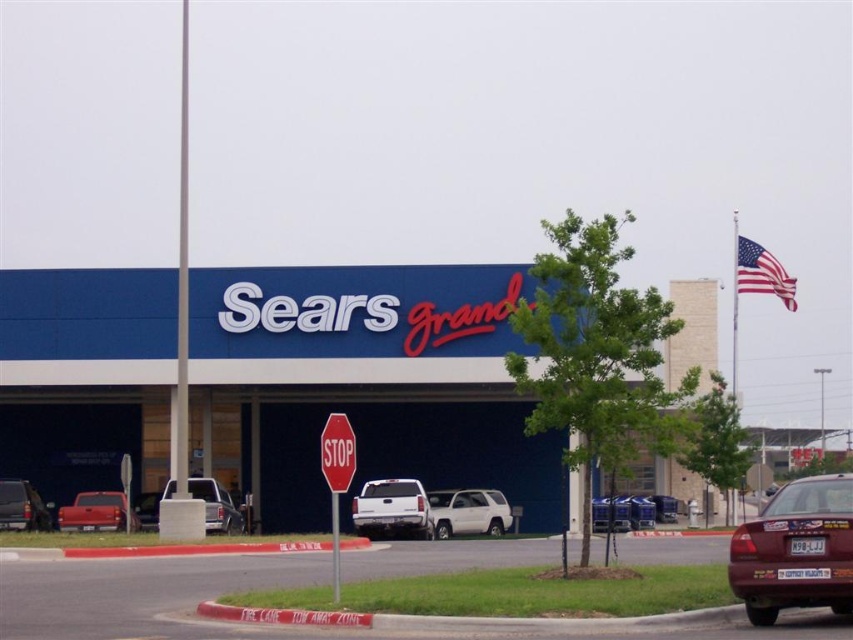
You are a delivery driver who needs to park your truck next to the maroon matte car at lower right. However, there is a height restriction of 6 feet in the parking spot. Given that the white matte suv at center is already parked there, can you safely park your truck without exceeding the height limit?

The maroon matte car at lower right has a lesser height compared to the white matte suv at center. Since the SUV is taller than the car and the height restriction is 6 feet, if the SUV is within the limit, then the maroon car is also under 6 feet. However, if the SUV exceeds the limit, the truck might also be too tall. Without knowing the SUVs exact height, it is uncertain whether parking is safe.

You are driving a car that is 5 meters long and want to park between the maroon matte car at lower right and the silver metallic truck at center. Is there enough space between them to park your car?

The distance between the maroon matte car at lower right and the silver metallic truck at center is 22.35 meters. Since your car is only 5 meters long, there is sufficient space to park between them.

You are standing at the entrance of the Sears Grand store and want to locate your maroon matte car at lower right. According to the coordinates provided, where should you look relative to the entrance?

The maroon matte car at lower right is located at coordinates point (795, 548), which is near the foreground on the right side of the image relative to the entrance.